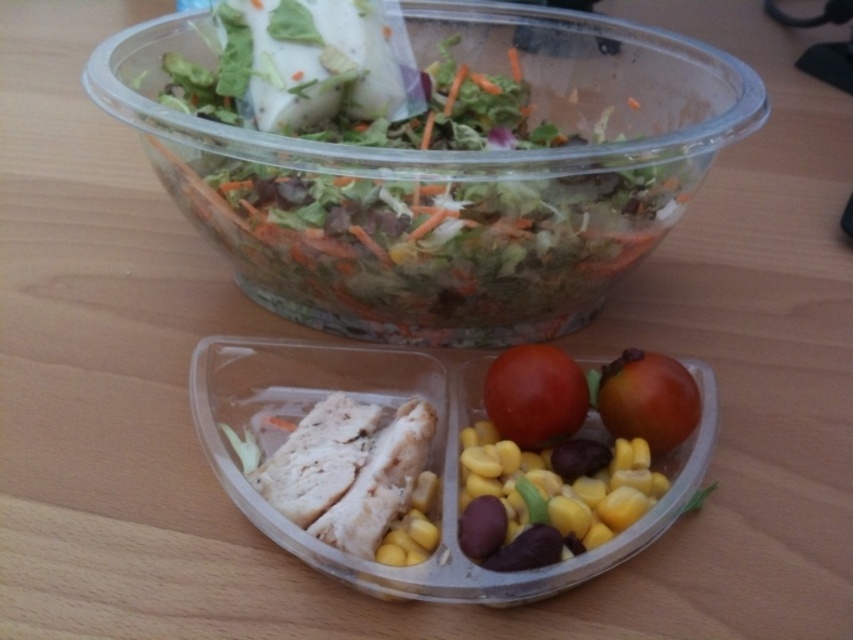
You are a delivery robot that needs to place a package on the wooden surface. The package must be placed exactly at one of the two points given. However, there are two points marked on the surface. The first point is at coordinates point [526,420] and the second is at point [653,369]. Which point should you choose to ensure the package is closer to you?

Point [526,420] is closer to the viewer than point [653,369], so you should choose point [526,420] to place the package closer to you.

You are arranging a meal on a table and have two tomatoes in front of you. One is a red matte tomato at center and the other is a glossy red tomato at center. If you want to place the taller tomato on top of a stack, which one should you choose?

The red matte tomato at center is much taller than the glossy red tomato at center, so you should choose the red matte tomato at center to place on top of the stack.

You are setting up a table for a picnic and have both the translucent plastic bowl at upper center and the glossy red tomato at center. Which object should you place first if you want to ensure stability?

The translucent plastic bowl at upper center should be placed first because it is taller than the glossy red tomato at center, providing a stable base.